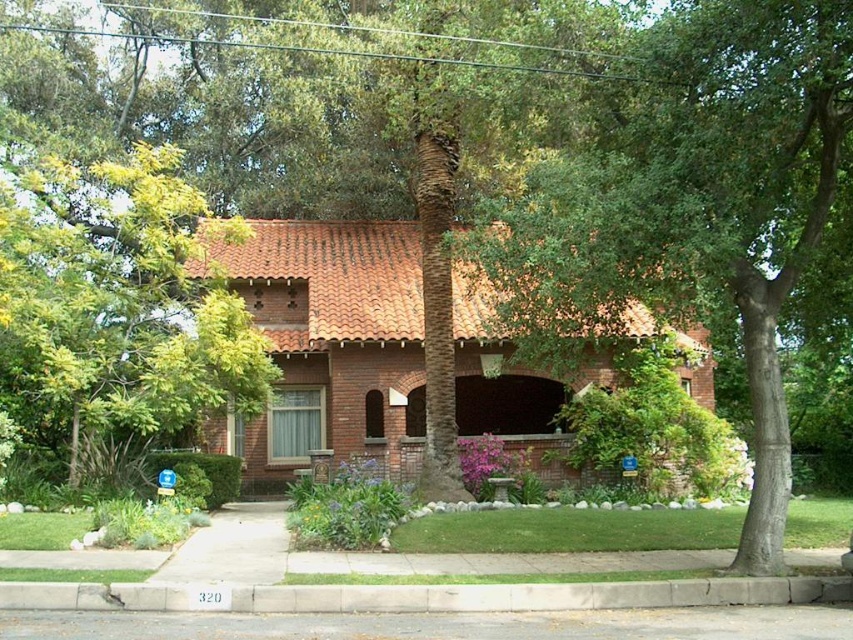
Does green leafy tree at upper left appear over gray concrete curb at lower center?

Correct, green leafy tree at upper left is located above gray concrete curb at lower center.

Can you confirm if green leafy tree at upper left is positioned to the right of gray concrete curb at lower center?

In fact, green leafy tree at upper left is to the left of gray concrete curb at lower center.

Does point (126, 193) come behind point (35, 589)?

Yes, it is behind point (35, 589).

Locate an element on the screen. This screenshot has height=640, width=853. green leafy tree at upper left is located at coordinates (120, 304).

Does green leafy tree at center have a greater width compared to green leafy tree at upper left?

No.

Does green leafy tree at center have a greater height compared to green leafy tree at upper left?

Incorrect, green leafy tree at center's height is not larger of green leafy tree at upper left's.

Is point (784, 422) more distant than point (189, 225)?

No, it is not.

Where is `green leafy tree at center`? The height and width of the screenshot is (640, 853). green leafy tree at center is located at coordinates (695, 202).

How much distance is there between green leafy tree at center and gray concrete curb at lower center?

green leafy tree at center is 7.16 meters away from gray concrete curb at lower center.

Can you confirm if green leafy tree at center is positioned below gray concrete curb at lower center?

Incorrect, green leafy tree at center is not positioned below gray concrete curb at lower center.

Between point (817, 160) and point (804, 579), which one is positioned behind?

The point (817, 160) is behind.

In order to click on green leafy tree at center in this screenshot , I will do pyautogui.click(x=695, y=202).